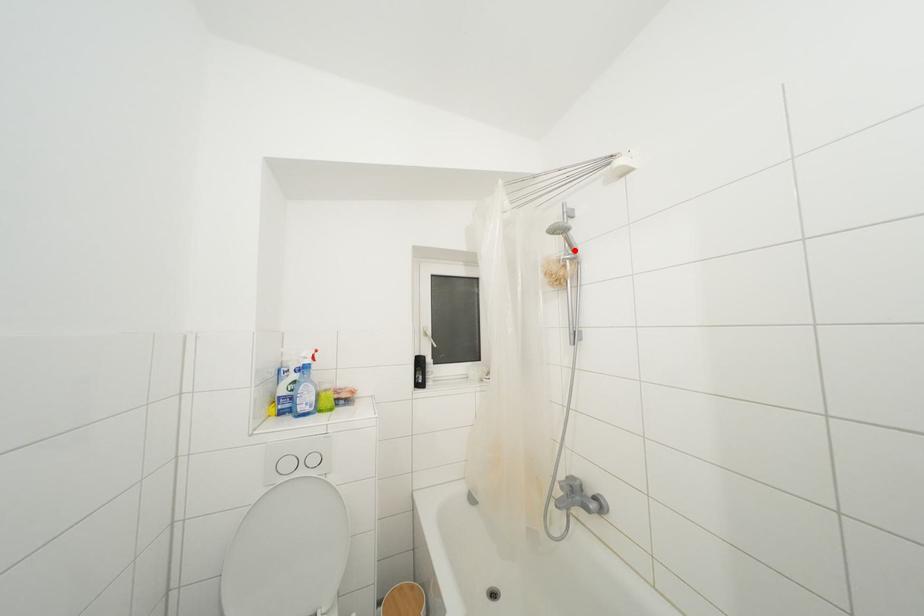
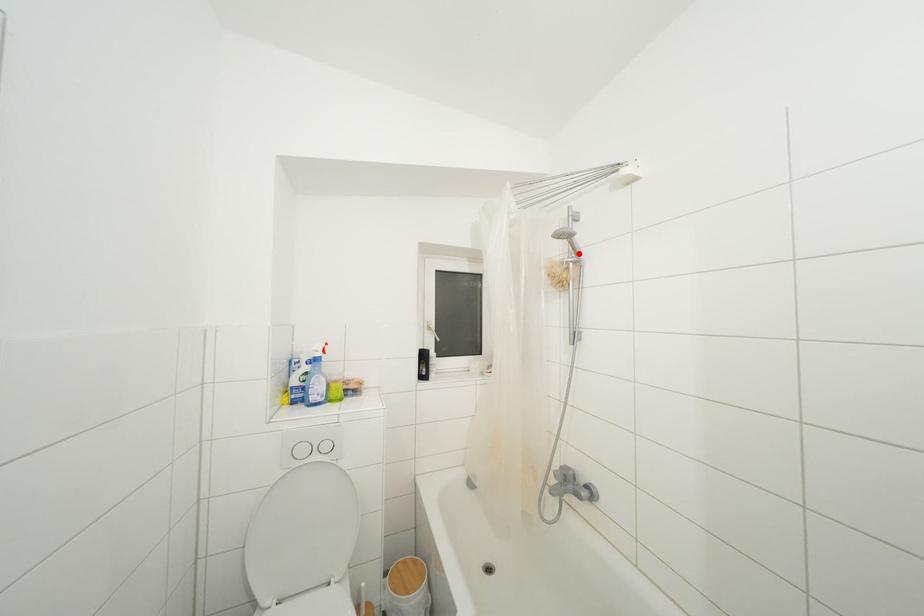
I am providing you with two images of the same scene from different viewpoints. A red point is marked on the first image and another point is marked on the second image. Are the points marked in image1 and image2 representing the same 3D position?

Yes